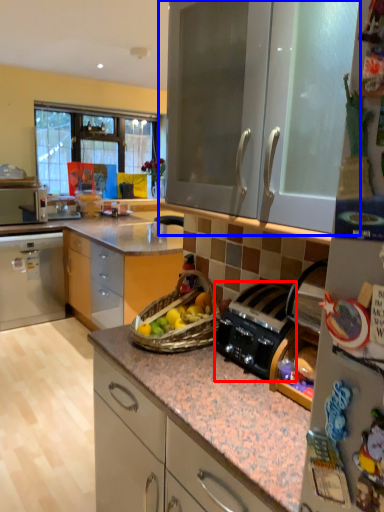
Question: Which object is closer to the camera taking this photo, kitchen appliance (highlighted by a red box) or cabinetry (highlighted by a blue box)?

Choices:
 (A) kitchen appliance
 (B) cabinetry

Answer: (B)